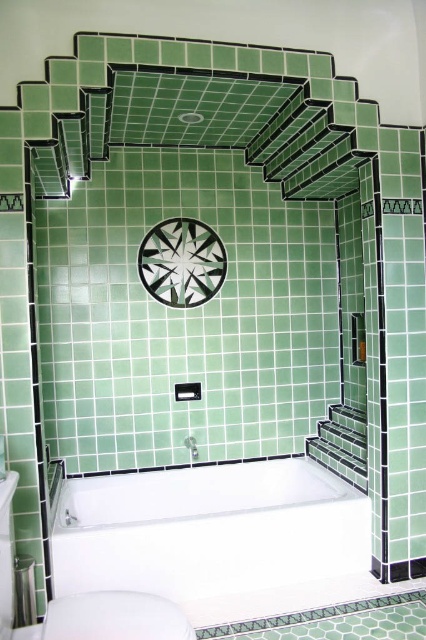
You are standing in the Art Deco bathroom and want to clean both the white glossy toilet bowl at lower center and the white glossy shower head at upper center. Which one should you clean first if you want to start with the one that is nearest to you?

You should clean the white glossy toilet bowl at lower center first because it is closer to the viewer than the white glossy shower head at upper center.

You are designing a bathroom layout and need to place a 1.2 meter wide vanity next to the white glossy sink at lower left and the white glossy toilet bowl at lower center. Considering their widths, which object should the vanity be placed next to to ensure it fits properly?

The white glossy sink at lower left is wider than the white glossy toilet bowl at lower center. Since the vanity is 1.2 meters wide, it should be placed next to the white glossy sink at lower left to accommodate its width.